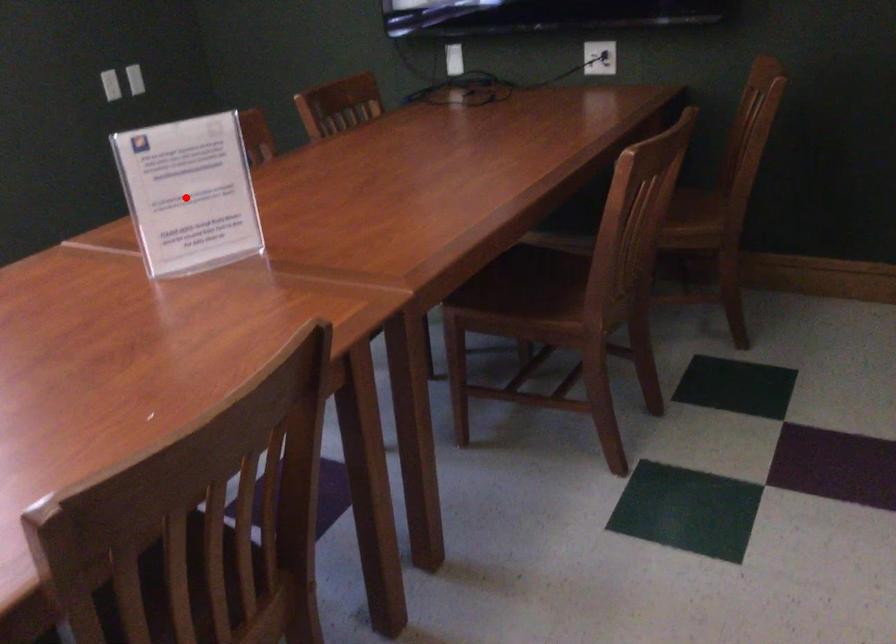
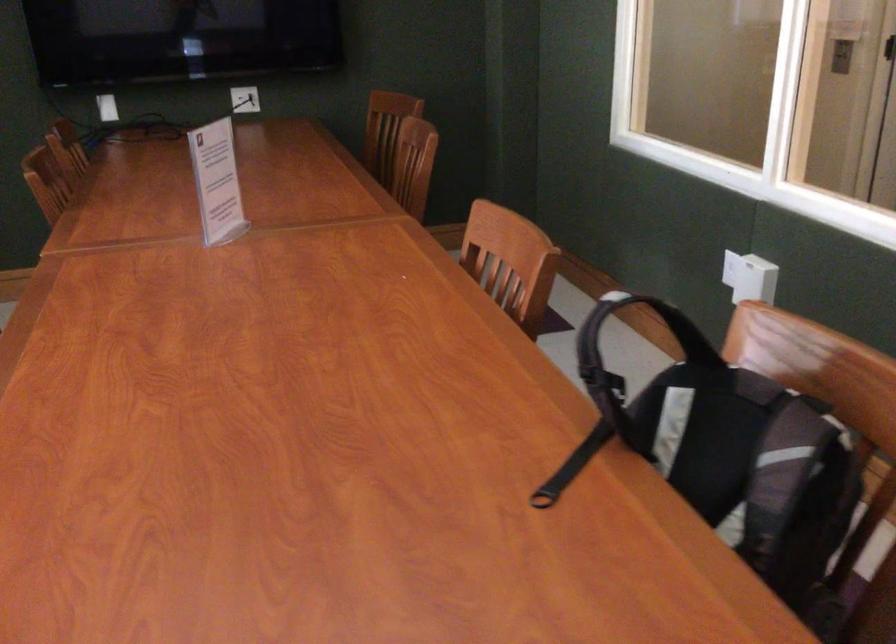
Question: A red point is marked in image1. In image2, is the corresponding 3D point closer to the camera or farther? Reply with the corresponding letter.

Choices:
 (A) The corresponding 3D point is closer.
 (B) The corresponding 3D point is farther.

Answer: (B)